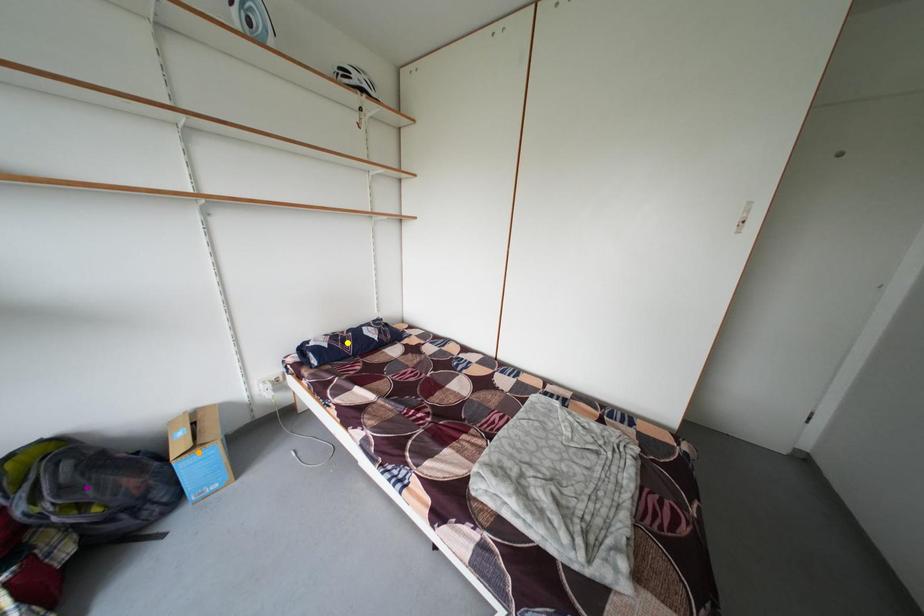
Order these from nearest to farthest:
orange point
yellow point
purple point

1. purple point
2. orange point
3. yellow point